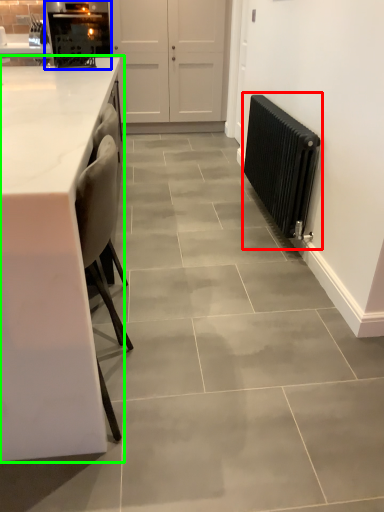
Question: Estimate the real-world distances between objects in this image. Which object is closer to radiator (highlighted by a red box), appliance (highlighted by a blue box) or countertop (highlighted by a green box)?

Choices:
 (A) appliance
 (B) countertop

Answer: (B)